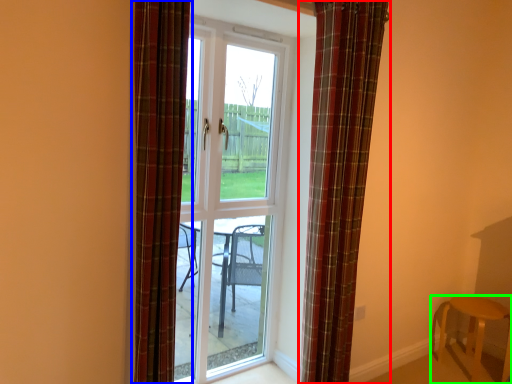
Question: Estimate the real-world distances between objects in this image. Which object is farther from curtain (highlighted by a red box), curtain (highlighted by a blue box) or furniture (highlighted by a green box)?

Choices:
 (A) curtain
 (B) furniture

Answer: (B)